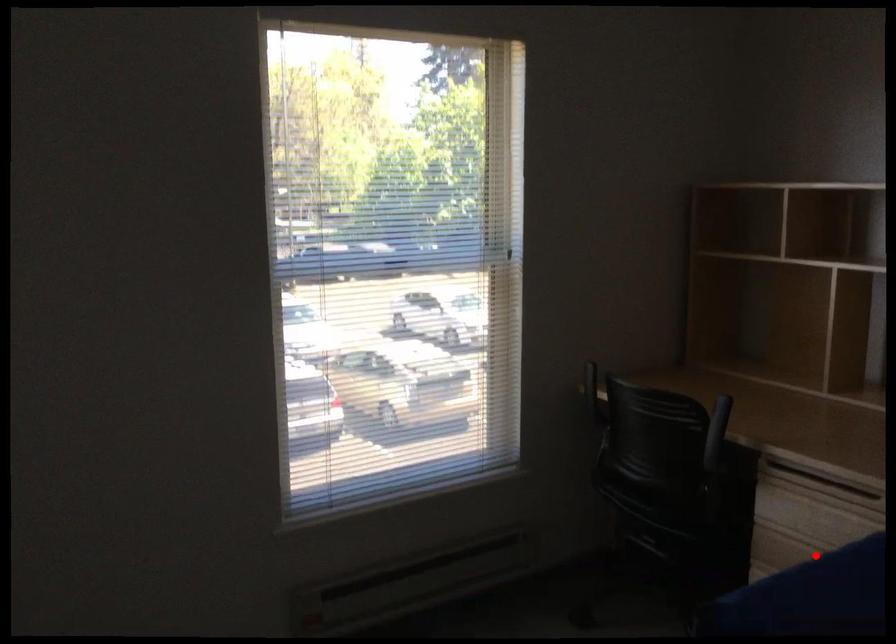
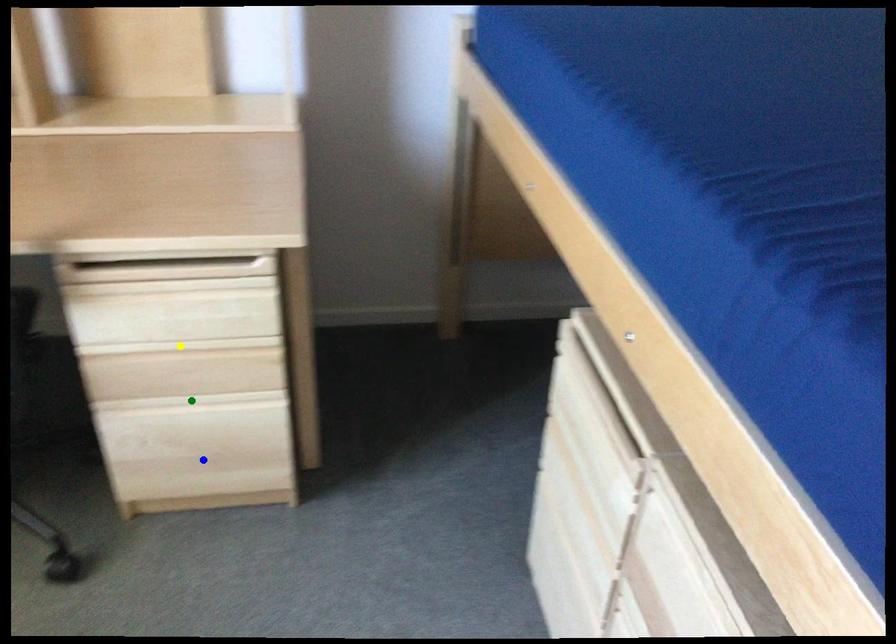
Question: I am providing you with two images of the same scene from different viewpoints. A red point is marked on the first image. You are given multiple points on the second image. Which point in image 2 represents the same 3d spot as the red point in image 1?

Choices:
 (A) yellow point
 (B) green point
 (C) blue point

Answer: (A)